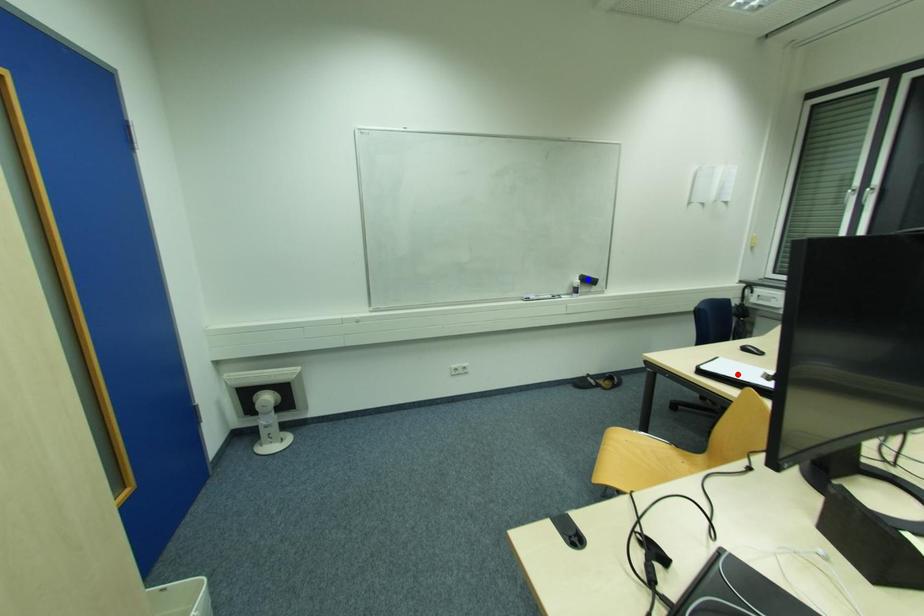
Question: Two points are marked on the image. Which point is closer to the camera?

Choices:
 (A) Blue point is closer.
 (B) Red point is closer.

Answer: (B)